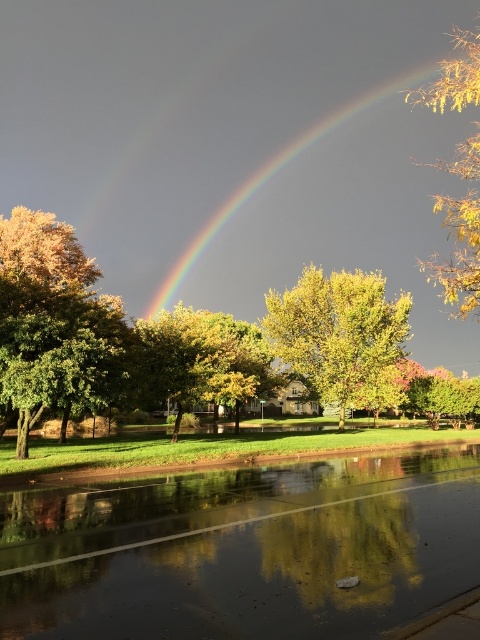
You are a delivery drone flying at an altitude of 4 meters. You need to land on the glossy asphalt flood at lower center. The drone requires a minimum of 3 meters of clear space around it to land safely. Is there enough space?

The glossy asphalt flood at lower center has a clear space of 3.77 meters around it, which is more than the required 3 meters, so yes, the drone can land safely.

You are a photographer trying to capture the reflection of the rainbow in the glossy asphalt flood at lower center. Based on the scene, can you determine if the rainbow at center will be fully visible in the reflection?

The glossy asphalt flood at lower center has a lesser height compared to the rainbow at center, so the rainbow at center will not be fully visible in the reflection because the flood is shorter in height than the rainbow.